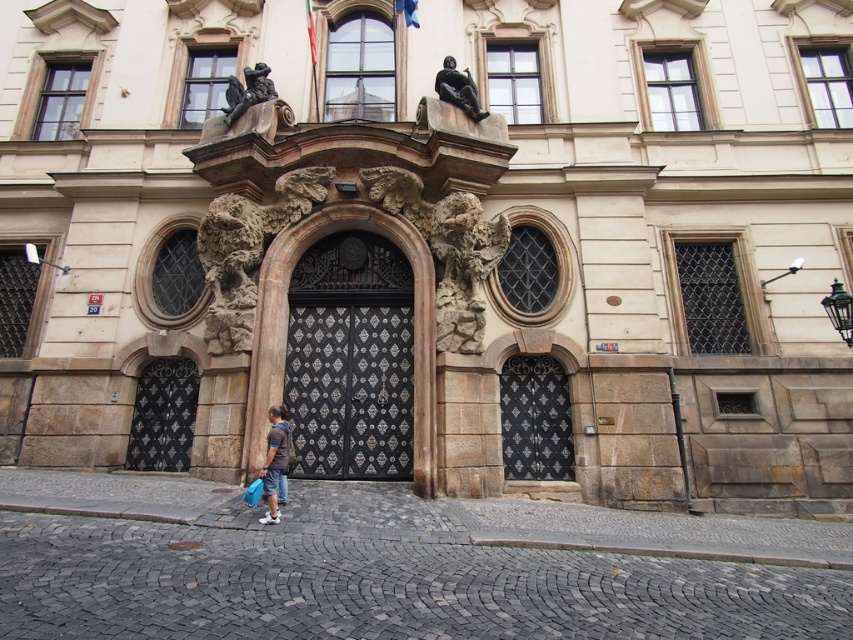
Question: Can you confirm if dark blue shirt at center is bigger than polished bronze statue at upper center?

Choices:
 (A) yes
 (B) no

Answer: (B)

Question: Considering the real-world distances, which object is farthest from the polished bronze statue at upper center?

Choices:
 (A) dark gray stone statue at upper center
 (B) dark blue shirt at center

Answer: (B)

Question: Is dark blue shirt at center wider than polished bronze statue at upper center?

Choices:
 (A) yes
 (B) no

Answer: (B)

Question: Which point is closer to the camera?

Choices:
 (A) polished bronze statue at upper center
 (B) dark gray stone statue at upper center

Answer: (A)

Question: In this image, where is dark blue shirt at center located relative to dark gray stone statue at upper center?

Choices:
 (A) left
 (B) right

Answer: (B)

Question: Which point is closer to the camera?

Choices:
 (A) dark gray stone statue at upper center
 (B) polished bronze statue at upper center
 (C) dark blue shirt at center

Answer: (C)